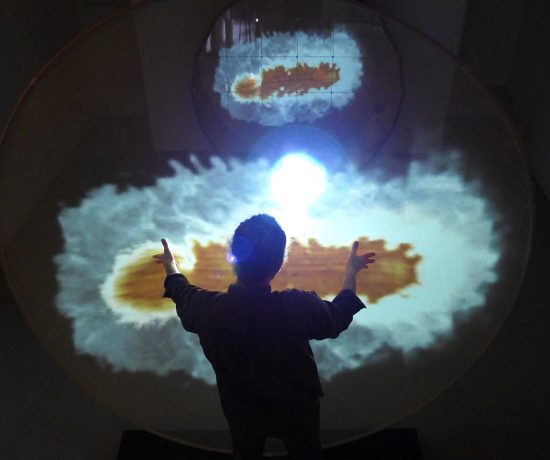
Image resolution: width=550 pixels, height=460 pixels. What are the coordinates of `light` in the screenshot? It's located at (297, 176).